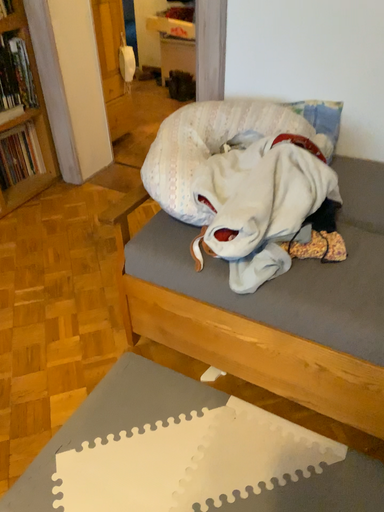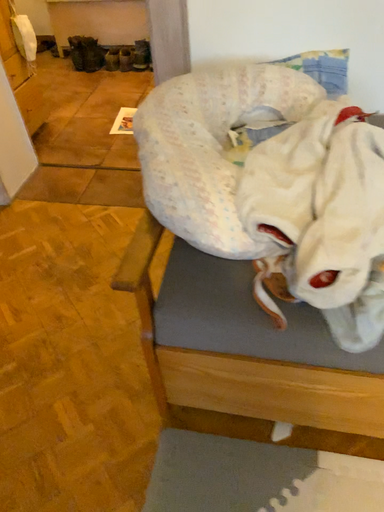
Question: Which way did the camera rotate in the video?

Choices:
 (A) rotated left
 (B) rotated right

Answer: (B)